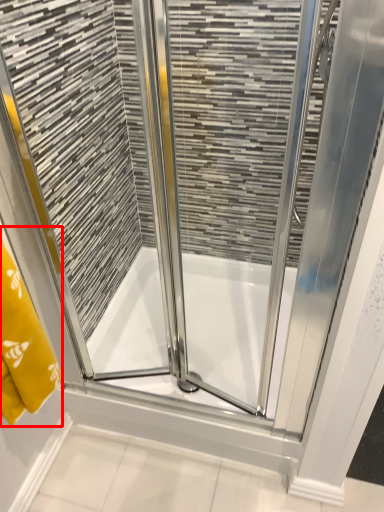
Question: Where is bath towel (annotated by the red box) located in relation to bath in the image?

Choices:
 (A) right
 (B) left

Answer: (B)